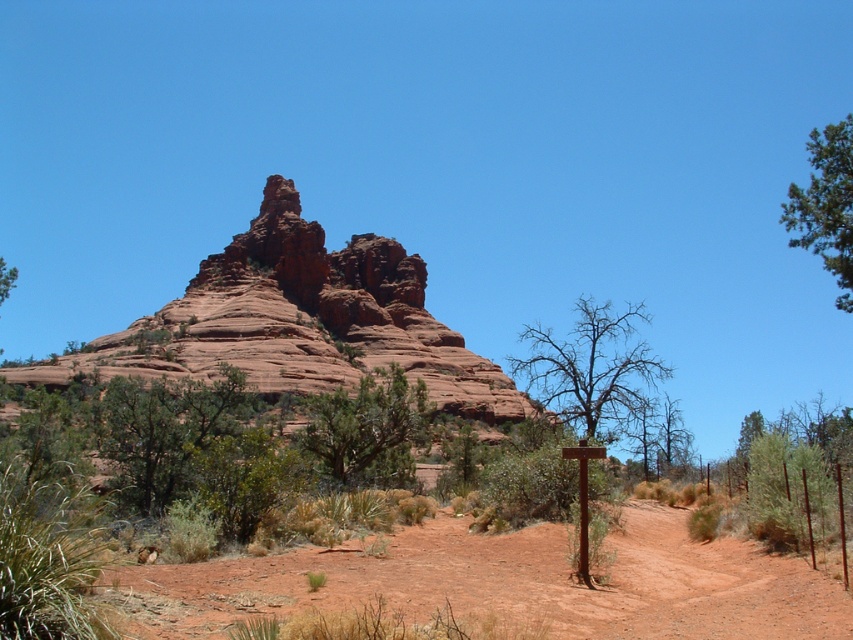
You are standing on the dirt path in the foreground of the landscape. You see two points marked on the ground. One is at point coordinates point (851, 116) and the other at point coordinates point (6, 266). Which point is closer to you?

Point (851, 116) is in front of point (6, 266), so the point closer to you is point (851, 116).

You are a hiker trying to reach a water source located behind the green leafy tree at upper left. You see the dusty red dirt track at center. Is the track between you and the tree?

Yes, the dusty red dirt track at center is in front of the green leafy tree at upper left, so the track is between you and the tree. To reach the water source behind the tree, you would need to go around or through the track.